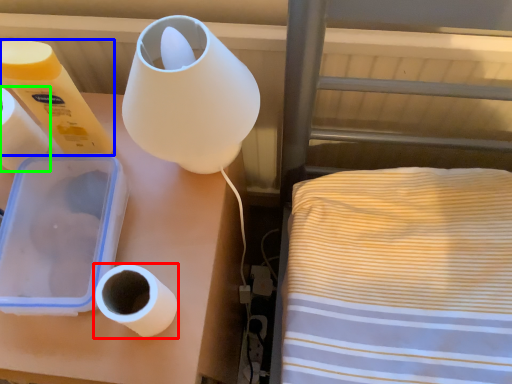
Question: Which object is the closest to the toilet paper (highlighted by a red box)? Choose among these: toilet paper (highlighted by a blue box) or paper towel (highlighted by a green box).

Choices:
 (A) toilet paper
 (B) paper towel

Answer: (A)